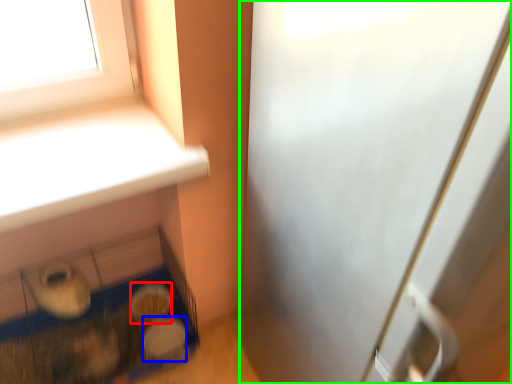
Question: Which is farther away from food (highlighted by a red box)? food (highlighted by a blue box) or screen door (highlighted by a green box)?

Choices:
 (A) food
 (B) screen door

Answer: (B)